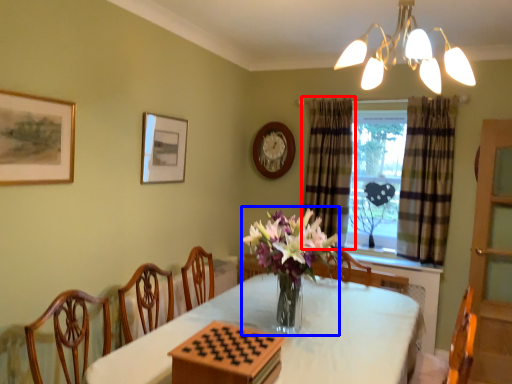
Question: Which object is closer to the camera taking this photo, curtain (highlighted by a red box) or floral arrangement (highlighted by a blue box)?

Choices:
 (A) curtain
 (B) floral arrangement

Answer: (B)